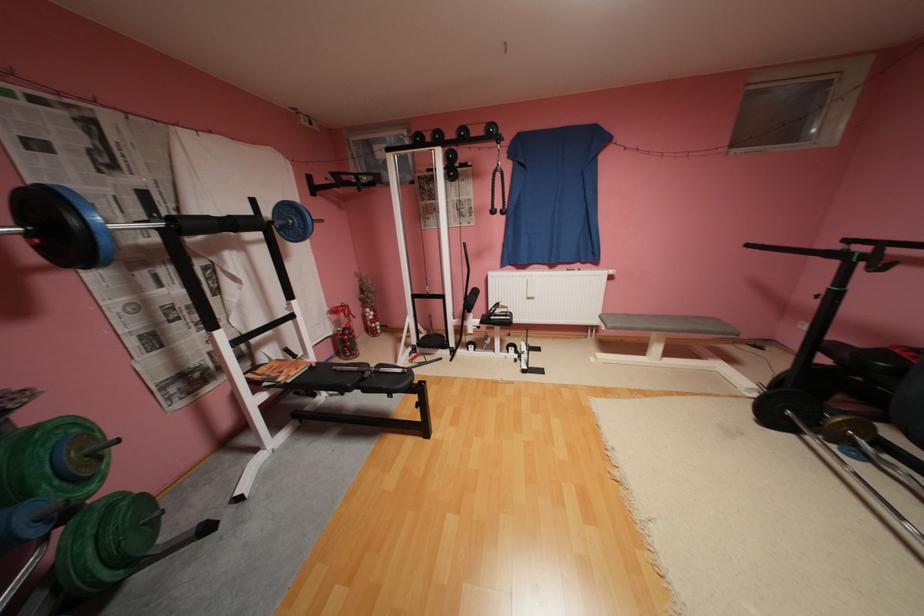
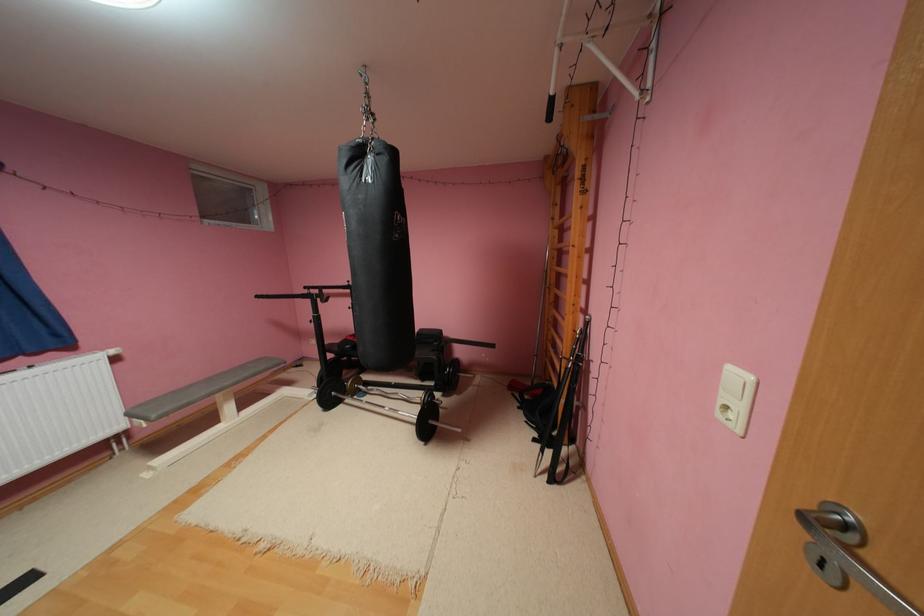
Question: How did the camera likely rotate?

Choices:
 (A) Left
 (B) Right
 (C) Up
 (D) Down

Answer: (B)